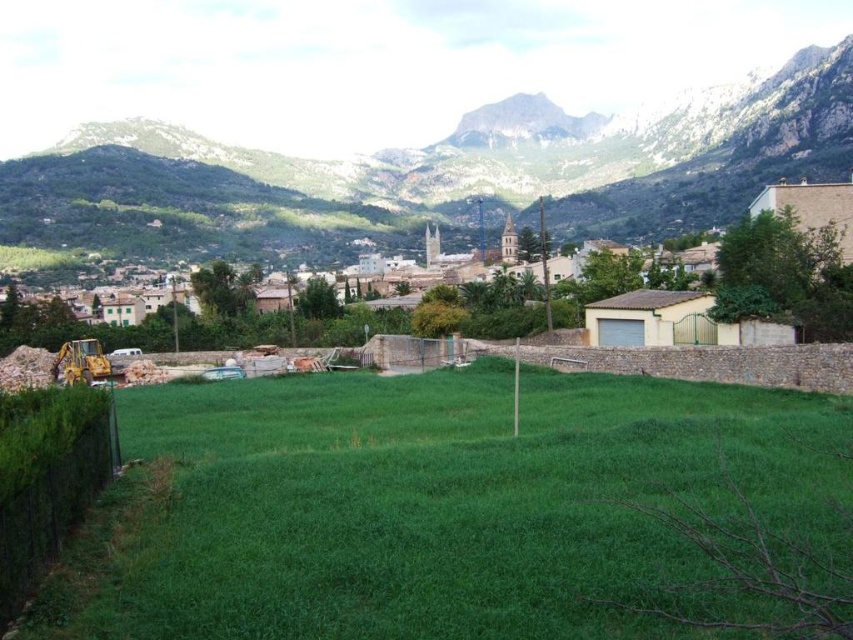
You are standing at the edge of the green grassy field at lower left and want to reach the yellow metallic excavator at lower left. Which direction should you move to get there?

Since the green grassy field at lower left is below the yellow metallic excavator at lower left, you should move upward to reach the yellow metallic excavator at lower left from the green grassy field at lower left.

You are a construction worker who needs to move the yellow metallic excavator at lower left to the base of the rocky brown mountain at upper center. Based on the scene, is the excavator currently positioned below or above the mountain?

The rocky brown mountain at upper center is located above the yellow metallic excavator at lower left, so the excavator is positioned below the mountain.

You are a surveyor trying to assess the area of the green grassy field at lower left and the yellow metallic excavator at lower left. Which one has a larger area?

The green grassy field at lower left is bigger than the yellow metallic excavator at lower left, so it has a larger area.